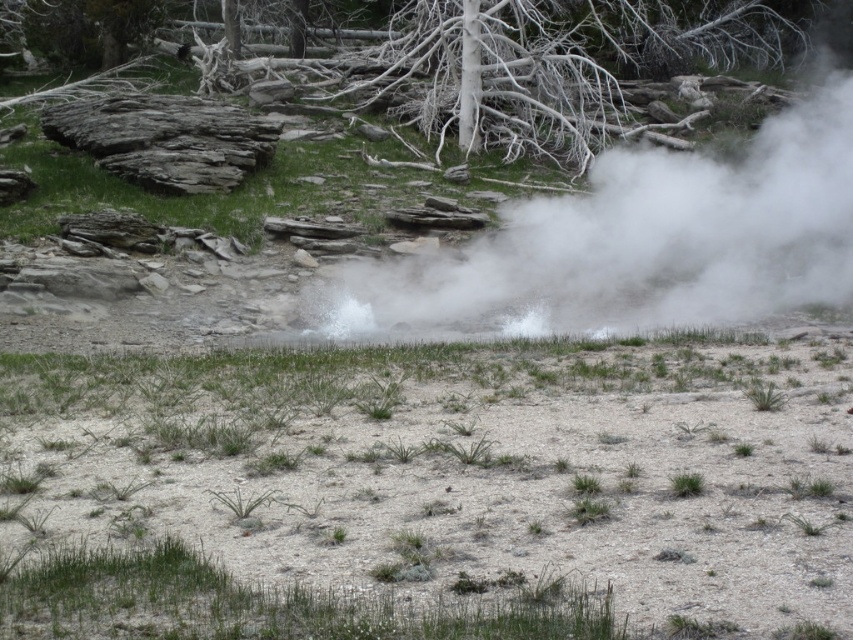
Question: Does dull brown dirt at center have a greater width compared to white bark tree at upper center?

Choices:
 (A) no
 (B) yes

Answer: (A)

Question: Which object is positioned farthest from the white vapor steam at center?

Choices:
 (A) white bark tree at upper center
 (B) dull brown dirt at center

Answer: (A)

Question: Is the position of white vapor steam at center less distant than that of white bark tree at upper center?

Choices:
 (A) yes
 (B) no

Answer: (A)

Question: Which of the following is the farthest from the observer?

Choices:
 (A) white bark tree at upper center
 (B) white vapor steam at center

Answer: (A)

Question: Which point is closer to the camera?

Choices:
 (A) dull brown dirt at center
 (B) white vapor steam at center

Answer: (A)

Question: Does white vapor steam at center appear over white bark tree at upper center?

Choices:
 (A) yes
 (B) no

Answer: (B)